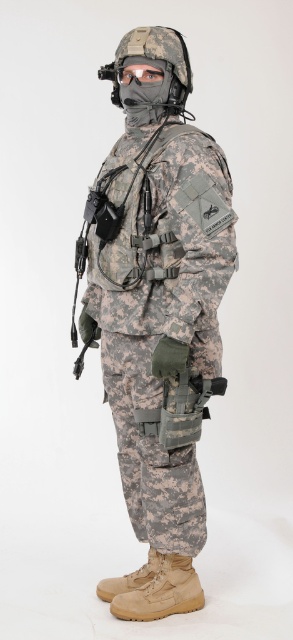
Can you confirm if camouflage fabric uniform at center is shorter than matte black goggles at center?

No.

Between camouflage fabric uniform at center and matte black goggles at center, which one has less height?

matte black goggles at center is shorter.

Who is more forward, (x=121, y=150) or (x=143, y=77)?

Point (x=143, y=77)

At what (x,y) coordinates should I click in order to perform the action: click on camouflage fabric uniform at center. Please return your answer as a coordinate pair (x, y). This screenshot has width=293, height=640. Looking at the image, I should click on (157, 314).